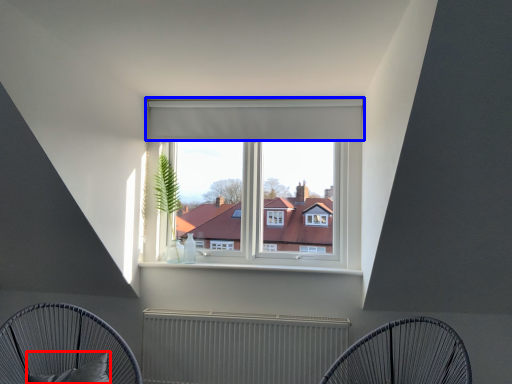
Question: Which object appears farthest to the camera in this image, pillow (highlighted by a red box) or curtain (highlighted by a blue box)?

Choices:
 (A) pillow
 (B) curtain

Answer: (B)